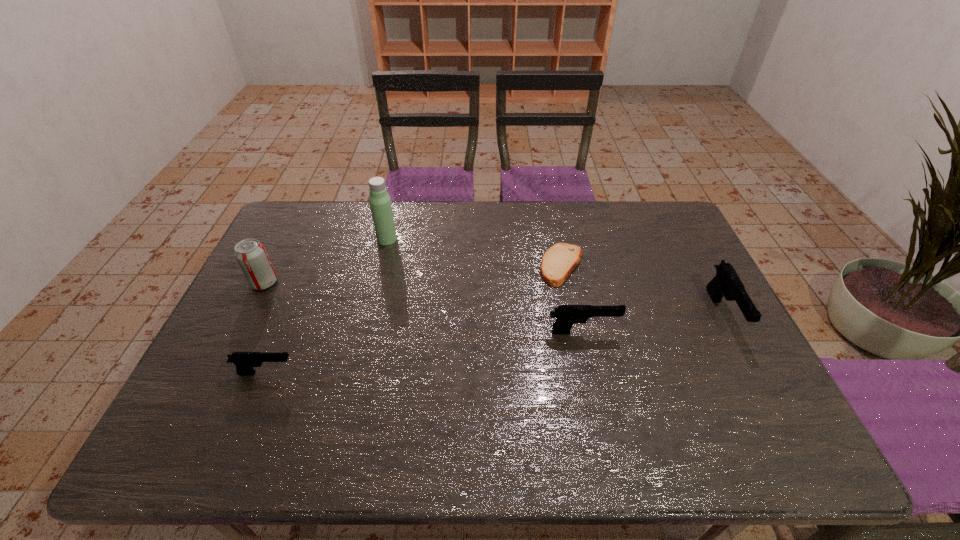
Find the location of a particular element. Image resolution: width=960 pixels, height=540 pixels. the fifth tallest object is located at coordinates (245, 361).

Find the location of a particular element. Image resolution: width=960 pixels, height=540 pixels. the leftmost pistol is located at coordinates (245, 361).

What are the coordinates of `the third shortest object` in the screenshot? It's located at pos(567,315).

This screenshot has height=540, width=960. I want to click on the second tallest pistol, so click(x=567, y=315).

Where is `the rightmost object`? This screenshot has width=960, height=540. the rightmost object is located at coordinates (727, 283).

Identify the location of the rightmost pistol. (727, 283).

Locate an element on the screen. Image resolution: width=960 pixels, height=540 pixels. the tallest object is located at coordinates (380, 202).

Locate an element on the screen. This screenshot has width=960, height=540. thermos bottle is located at coordinates (380, 202).

The image size is (960, 540). Find the location of `the shortest object`. the shortest object is located at coordinates (559, 261).

Where is `the leftmost object`? the leftmost object is located at coordinates (250, 254).